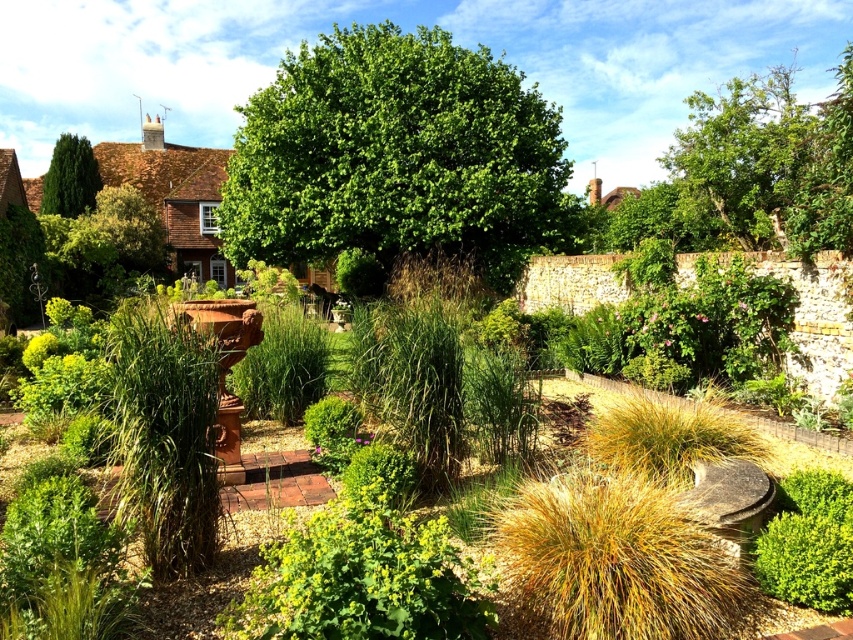
You are standing in the garden and see a point marked at coordinates (397, 156). Based on the scene description, what is the nearest object to this point?

The point at coordinates (397, 156) is on the green leafy tree at center, so the nearest object to this point is the green leafy tree at center.

You are a gardener planning to plant a new flowerbed between the green leafy bush at lower right and the green glossy tree at upper left. Based on their positions, where should you place the flowerbed to ensure it is between both objects?

The green leafy bush at lower right is positioned under the green glossy tree at upper left, so placing the flowerbed between them would require positioning it below the green glossy tree at upper left and above the green leafy bush at lower right.

You are standing in the garden and want to reach the green leafy bush at lower right. Which direction should you walk relative to the green leafy tree at center?

The green leafy bush at lower right is behind the green leafy tree at center, so you should walk behind the green leafy tree at center to reach it.